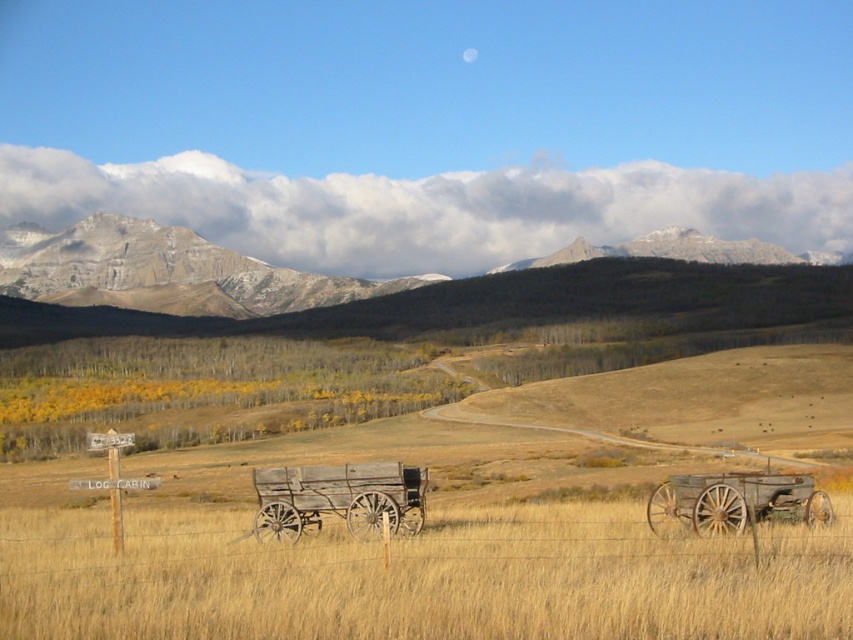
Is dry grass at center taller than weathered wood wagon at center?

Yes.

Between dry grass at center and weathered wood wagon at center, which one is positioned higher?

weathered wood wagon at center is higher up.

At what (x,y) coordinates should I click in order to perform the action: click on dry grass at center. Please return your answer as a coordinate pair (x, y). The width and height of the screenshot is (853, 640). Looking at the image, I should click on (421, 579).

Can you confirm if rocky gray mountains at upper center is wider than weathered wood wagon at center?

Yes.

Which is below, rocky gray mountains at upper center or weathered wood wagon at center?

Positioned lower is weathered wood wagon at center.

Which is in front, point (352, 285) or point (292, 486)?

Point (292, 486)

Identify the location of rocky gray mountains at upper center. (164, 272).

Which is below, dry grass at center or rustic wood wagon at right?

dry grass at center is below.

Is dry grass at center positioned in front of rustic wood wagon at right?

Yes, dry grass at center is closer to the viewer.

Does point (173, 545) lie in front of point (730, 480)?

No, (173, 545) is behind (730, 480).

The width and height of the screenshot is (853, 640). I want to click on dry grass at center, so click(x=421, y=579).